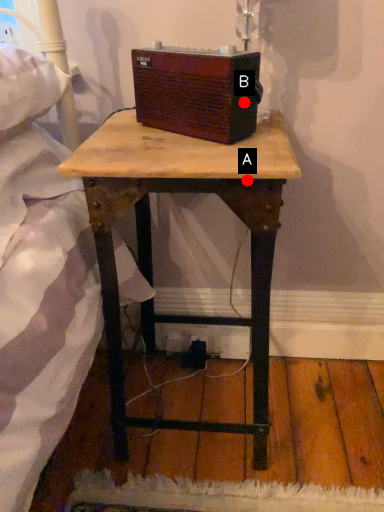
Question: Two points are circled on the image, labeled by A and B beside each circle. Which point is closer to the camera?

Choices:
 (A) A is closer
 (B) B is closer

Answer: (A)